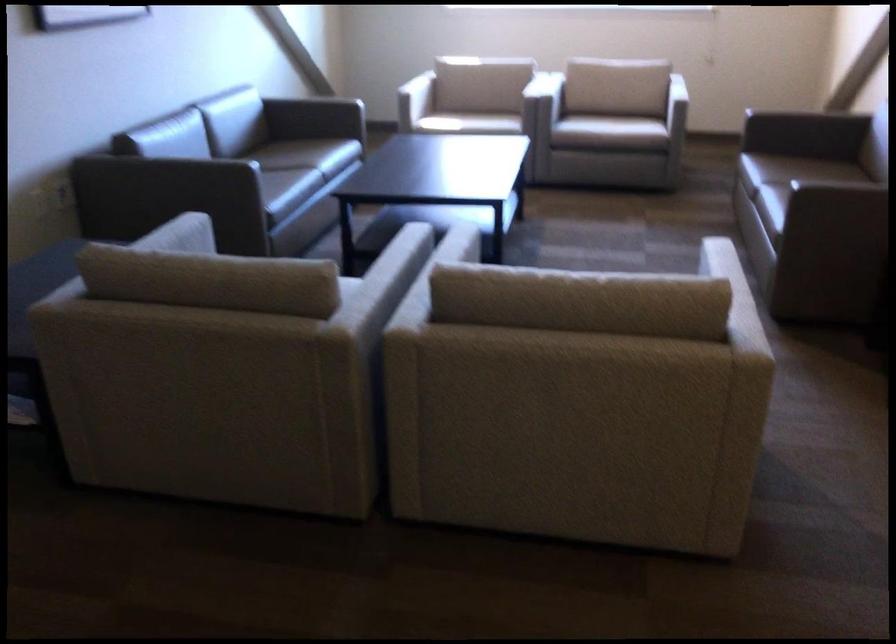
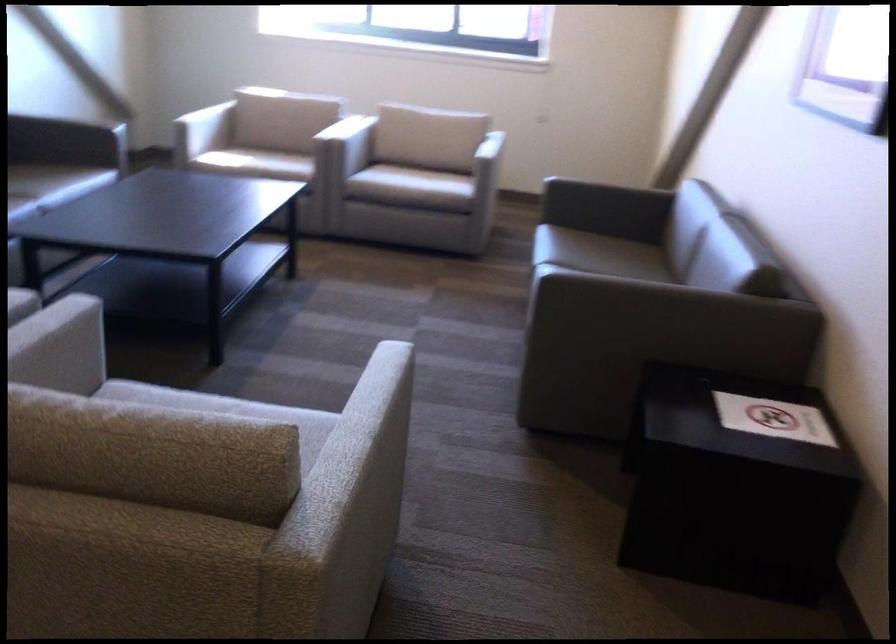
Locate, in the second image, the point that corresponds to point (608, 129) in the first image.

(412, 187)